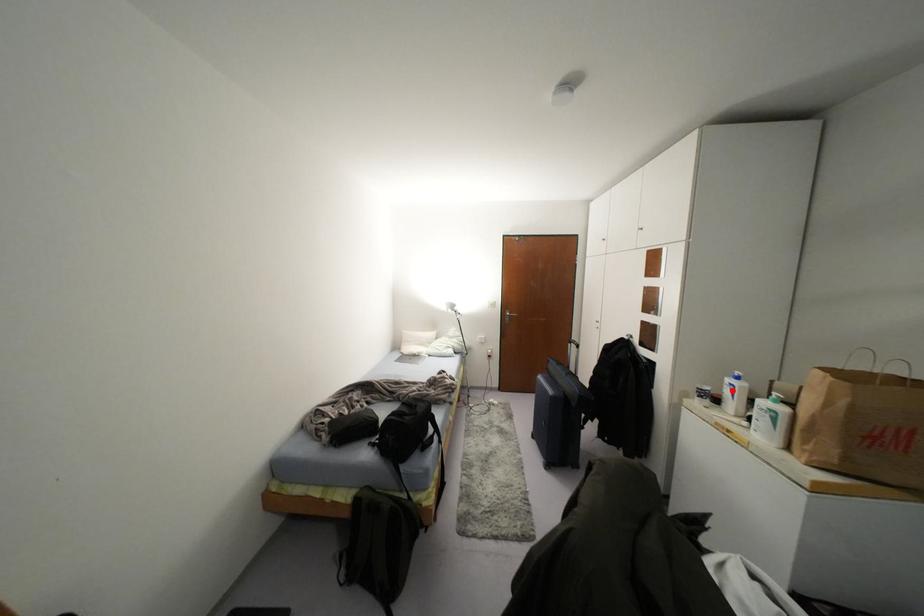
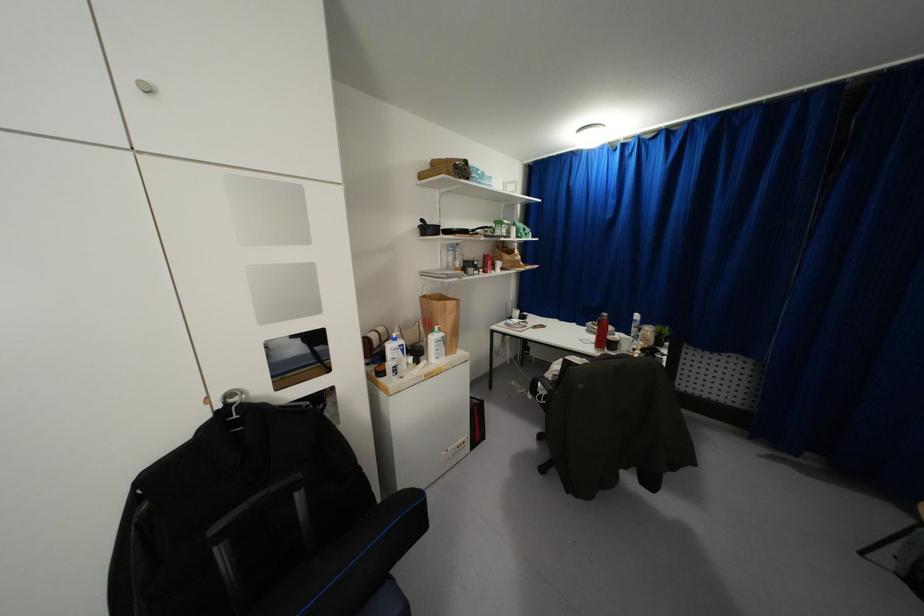
Question: I am providing you with two images of the same scene from different viewpoints. A red point is shown in image1. For the corresponding object point in image2, is it positioned nearer or farther from the camera?

Choices:
 (A) Nearer
 (B) Farther

Answer: (A)